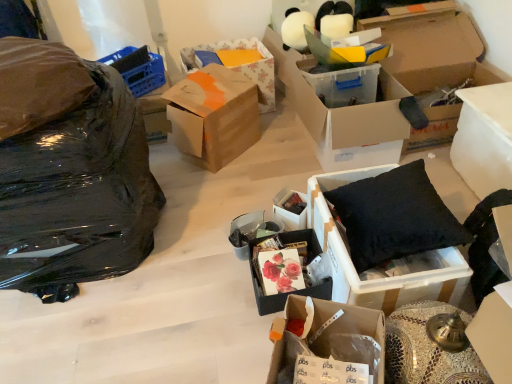
You are a GUI agent. You are given a task and a screenshot of the screen. Output one action in this format:
    pyautogui.click(x=<x>, y=<y>)
    Task: Click on the free space that is in between brown cardboard box at center, which ranks as the ninth box in right-to-left order, and transparent plastic box at center, which ranks as the 3th box in right-to-left order
    The height and width of the screenshot is (384, 512).
    Given the screenshot: What is the action you would take?
    pyautogui.click(x=267, y=157)